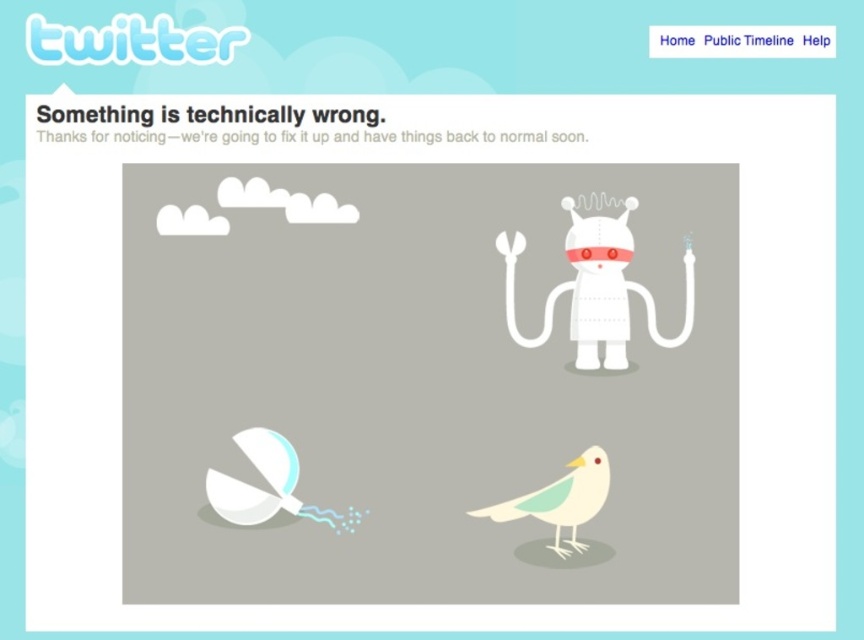
Who is more distant from viewer, (x=653, y=305) or (x=558, y=490)?

The point (x=653, y=305) is behind.

Is point (595, 246) positioned behind point (575, 472)?

Yes, it is behind point (575, 472).

Measure the distance between point (623, 227) and camera.

Point (623, 227) and camera are 69.44 centimeters apart.

Locate an element on the screen. white matte robot at center is located at coordinates (596, 289).